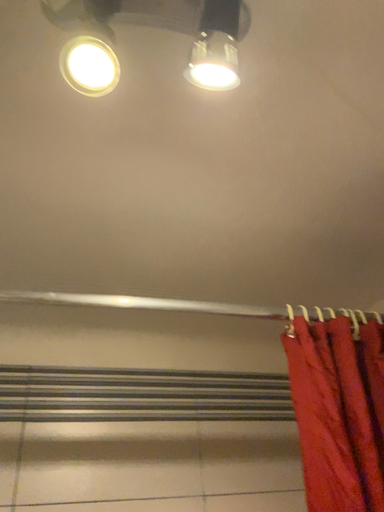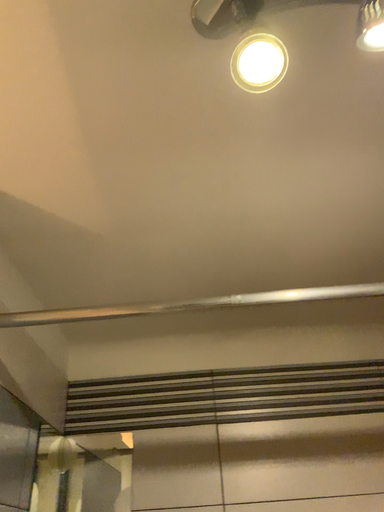
Question: Which way did the camera rotate in the video?

Choices:
 (A) rotated left
 (B) rotated right

Answer: (A)